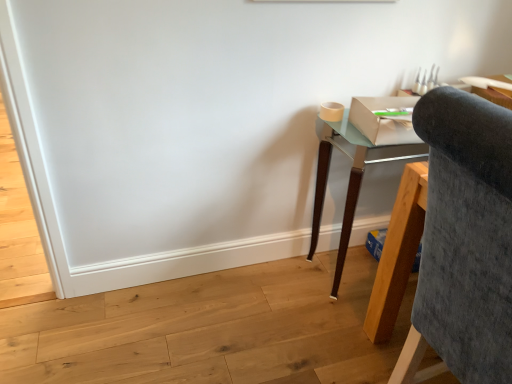
Question: Would you say velvet grey chair at right is inside or outside teal glass desk at right?

Choices:
 (A) outside
 (B) inside

Answer: (A)

Question: In terms of width, does velvet grey chair at right look wider or thinner when compared to teal glass desk at right?

Choices:
 (A) wide
 (B) thin

Answer: (A)

Question: From a real-world perspective, is velvet grey chair at right physically located above or below teal glass desk at right?

Choices:
 (A) above
 (B) below

Answer: (A)

Question: In terms of height, does teal glass desk at right look taller or shorter compared to velvet grey chair at right?

Choices:
 (A) tall
 (B) short

Answer: (B)

Question: Considering the positions of point (320, 145) and point (450, 354), is point (320, 145) closer or farther from the camera than point (450, 354)?

Choices:
 (A) farther
 (B) closer

Answer: (A)

Question: From the image's perspective, is teal glass desk at right located above or below velvet grey chair at right?

Choices:
 (A) below
 (B) above

Answer: (B)

Question: Is teal glass desk at right inside or outside of velvet grey chair at right?

Choices:
 (A) outside
 (B) inside

Answer: (A)